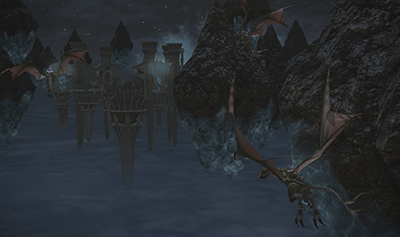
Where is `grey columns`? This screenshot has width=400, height=237. grey columns is located at coordinates (126, 106).